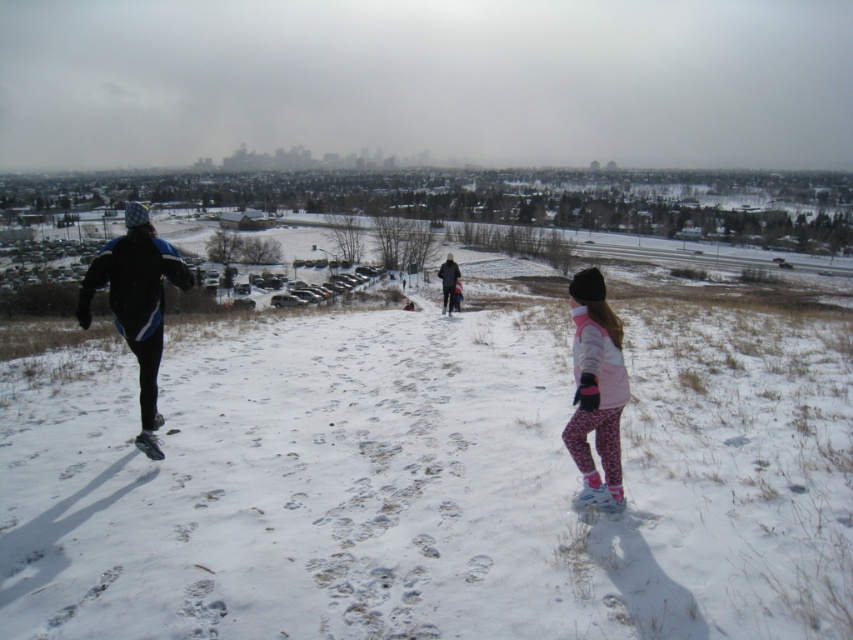
Is white fluffy snow at center positioned in front of pink fleece jacket at center?

That is True.

Is point (260, 324) farther from viewer compared to point (587, 456)?

That is True.

Is point (704, 484) positioned after point (599, 410)?

Yes.

I want to click on white fluffy snow at center, so (438, 417).

Is point (711, 333) behind point (106, 260)?

Yes, point (711, 333) is farther from viewer.

The image size is (853, 640). In order to click on white fluffy snow at center in this screenshot , I will do `click(438, 417)`.

This screenshot has height=640, width=853. I want to click on white fluffy snow at center, so click(438, 417).

What are the coordinates of `pink fleece jacket at center` in the screenshot? It's located at [x=596, y=388].

Can you confirm if pink fleece jacket at center is taller than dark blue jacket at center?

In fact, pink fleece jacket at center may be shorter than dark blue jacket at center.

Does point (606, 321) come farther from viewer compared to point (440, 282)?

No, (606, 321) is in front of (440, 282).

Identify the location of pink fleece jacket at center. This screenshot has height=640, width=853. (596, 388).